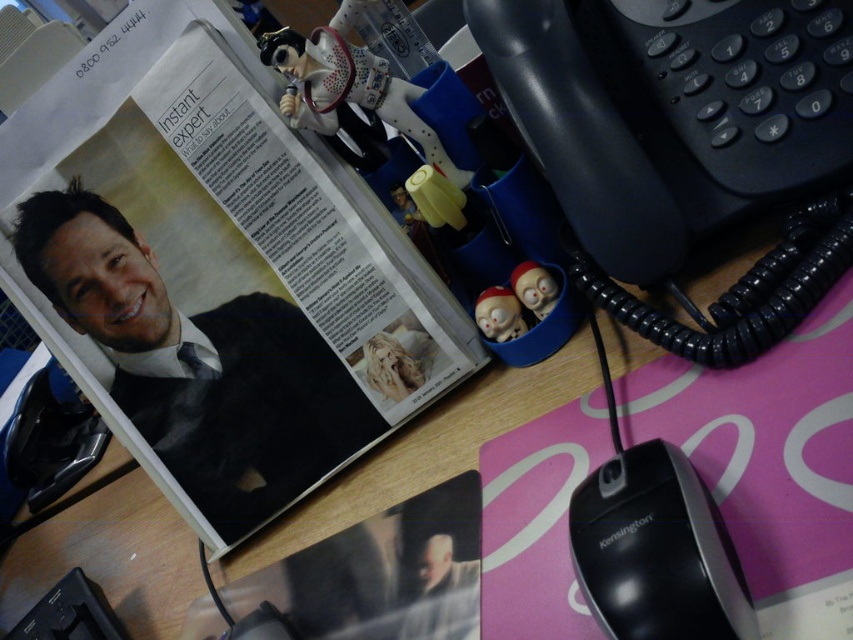
Can you confirm if matte black suit at upper left is positioned to the left of black plastic mouse at lower right?

Correct, you'll find matte black suit at upper left to the left of black plastic mouse at lower right.

Who is more distant from viewer, (264,346) or (695,636)?

The point (264,346) is more distant.

Identify the location of matte black suit at upper left. (196, 364).

Image resolution: width=853 pixels, height=640 pixels. I want to click on matte black suit at upper left, so click(x=196, y=364).